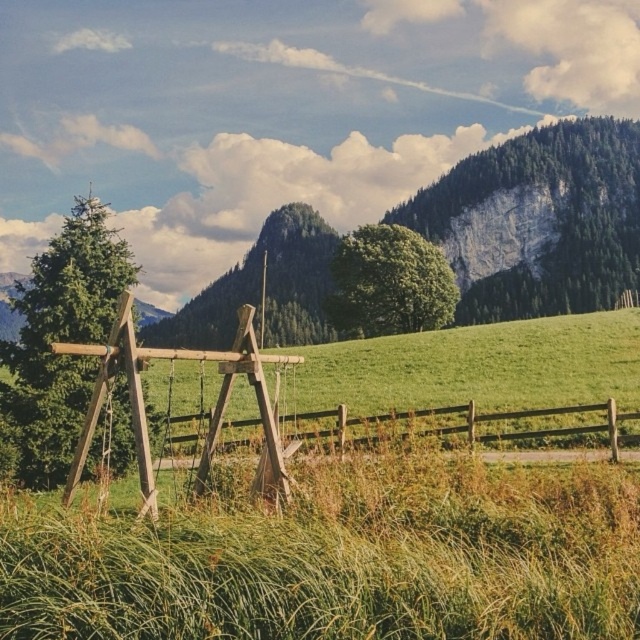
Based on the photo, you are standing in the middle of the green grassy at center and want to walk towards the brown wooden fence at center. Which direction should you walk to reach the fence?

Since the green grassy at center is positioned on the left side of the brown wooden fence at center, you should walk to the right to reach the fence.

You are standing at the wooden swing set in the foreground of the image. There is a specific point marked at coordinates point (346, 561). What is the object located exactly at this point?

The object located exactly at point (346, 561) is the green grassy at center.